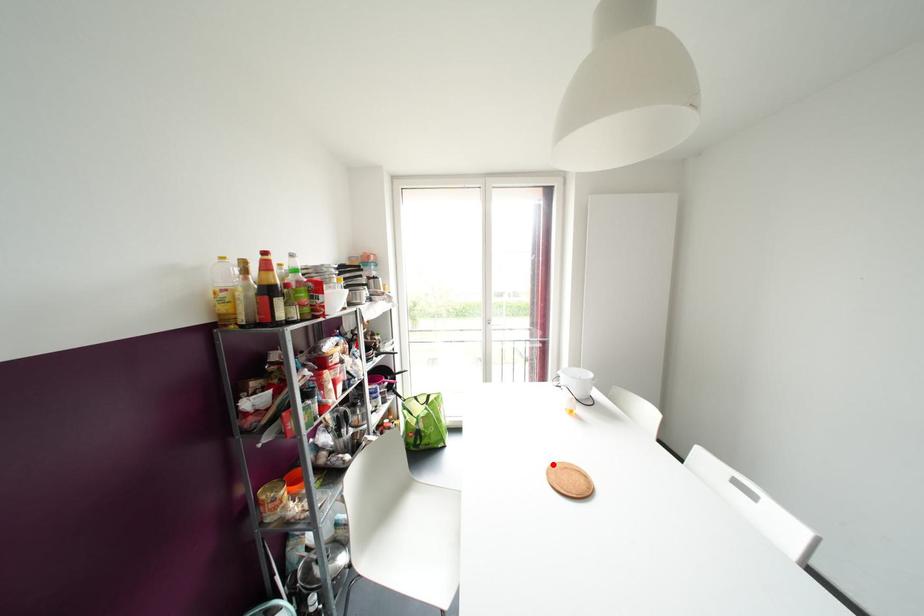
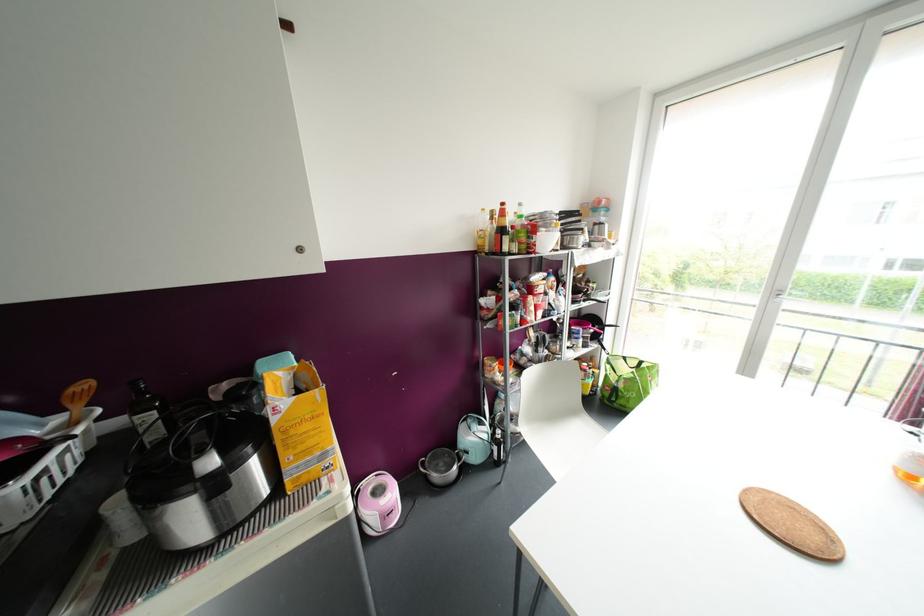
Question: I am providing you with two images of the same scene from different viewpoints. A red point is marked on the first image. Can you still see the location of the red point in image 2?

Choices:
 (A) Yes
 (B) No

Answer: (A)